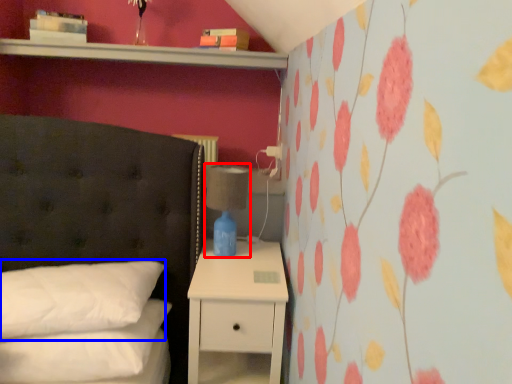
Question: Which of the following is the farthest to the observer, bedside lamp (highlighted by a red box) or pillow (highlighted by a blue box)?

Choices:
 (A) bedside lamp
 (B) pillow

Answer: (A)